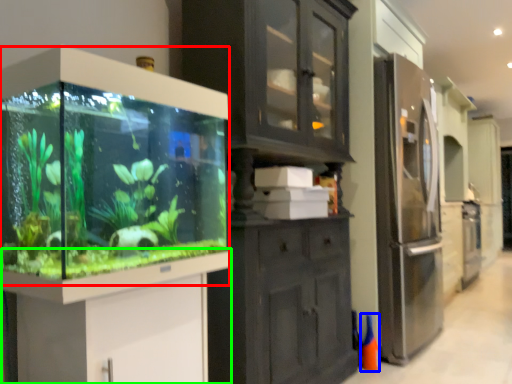
Question: Based on their relative distances, which object is nearer to glass box (highlighted by a red box)? Choose from cone (highlighted by a blue box) and vanity (highlighted by a green box).

Choices:
 (A) cone
 (B) vanity

Answer: (B)